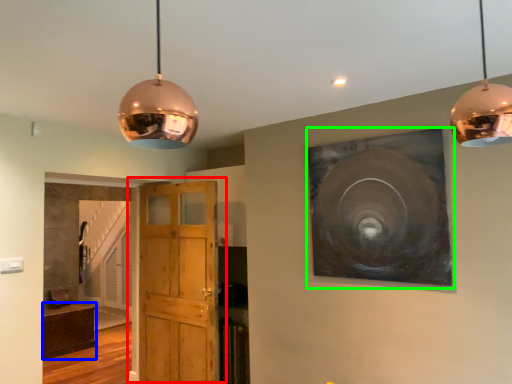
Question: Which is farther away from door (highlighted by a red box)? cabinetry (highlighted by a blue box) or picture frame (highlighted by a green box)?

Choices:
 (A) cabinetry
 (B) picture frame

Answer: (A)